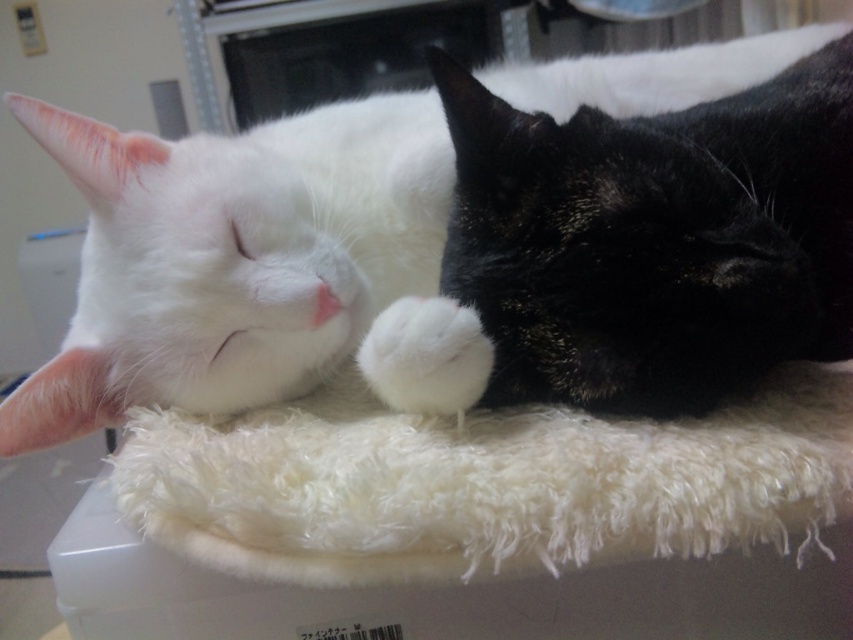
I want to click on white fluffy cat at center, so click(233, 257).

Between white fluffy cat at center and white fluffy cat bed at center, which one has less height?

With less height is white fluffy cat bed at center.

This screenshot has height=640, width=853. What do you see at coordinates (233, 257) in the screenshot?
I see `white fluffy cat at center` at bounding box center [233, 257].

The height and width of the screenshot is (640, 853). What are the coordinates of `white fluffy cat at center` in the screenshot? It's located at (233, 257).

The height and width of the screenshot is (640, 853). What are the coordinates of `white fluffy cat at center` in the screenshot? It's located at (233, 257).

Does point (91, 332) come behind point (849, 38)?

No, (91, 332) is in front of (849, 38).

Locate an element on the screen. Image resolution: width=853 pixels, height=640 pixels. white fluffy cat at center is located at coordinates (233, 257).

Based on the photo, does black shaggy cat at center have a greater height compared to white fluffy paw at center?

Indeed, black shaggy cat at center has a greater height compared to white fluffy paw at center.

Does black shaggy cat at center come behind white fluffy paw at center?

No, black shaggy cat at center is closer to the viewer.

Find the location of `black shaggy cat at center`. black shaggy cat at center is located at coordinates (654, 240).

Identify the location of black shaggy cat at center. (654, 240).